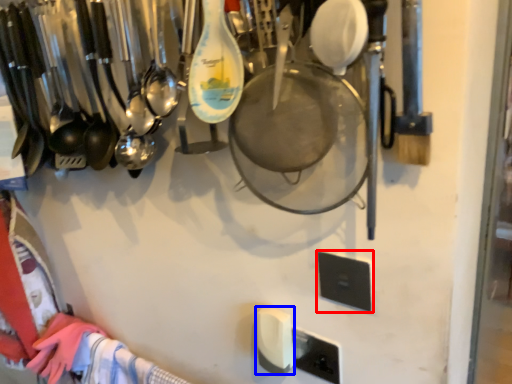
Question: Which of the following is the closest to the observer, light switch (highlighted by a red box) or light switch (highlighted by a blue box)?

Choices:
 (A) light switch
 (B) light switch

Answer: (A)